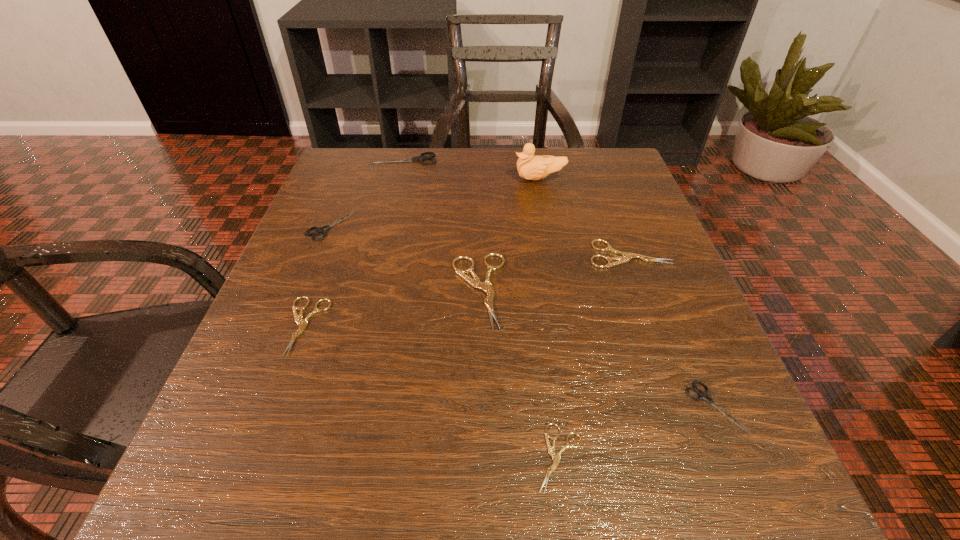
Image resolution: width=960 pixels, height=540 pixels. Identify the location of vacant region between the leftmost beige shears and the tallest object. (422, 252).

You are a GUI agent. You are given a task and a screenshot of the screen. Output one action in this format:
    pyautogui.click(x=<x>, y=<y>)
    Task: Click on the free spot between the third shears from right to left and the farthest shears
    
    Given the screenshot: What is the action you would take?
    483,308

This screenshot has height=540, width=960. What are the coordinates of `empty space between the rightmost beige shears and the nearest black shears` in the screenshot? It's located at (672, 330).

What are the coordinates of `free area in between the second beige shears from right to left and the smallest black shears` in the screenshot? It's located at (637, 433).

Locate an element on the screen. free spot between the smallest beige shears and the duckling is located at coordinates [550, 318].

Locate which object ranks sixth in proximity to the second beige shears from right to left. Please provide its 2D coordinates. Your answer should be formatted as a tuple, i.e. [(x, y)], where the tuple contains the x and y coordinates of a point satisfying the conditions above.

[(530, 167)]

Locate an element on the screen. The width and height of the screenshot is (960, 540). object that ranks as the fifth closest to the rightmost black shears is located at coordinates (302, 323).

Select which shears appears as the fifth closest to the rightmost black shears. Please provide its 2D coordinates. Your answer should be formatted as a tuple, i.e. [(x, y)], where the tuple contains the x and y coordinates of a point satisfying the conditions above.

[(319, 230)]

Locate an element on the screen. The image size is (960, 540). shears identified as the second closest to the tallest object is located at coordinates (627, 257).

Where is `black shears that is the closest to the rightmost black shears`? Image resolution: width=960 pixels, height=540 pixels. black shears that is the closest to the rightmost black shears is located at coordinates (x=319, y=230).